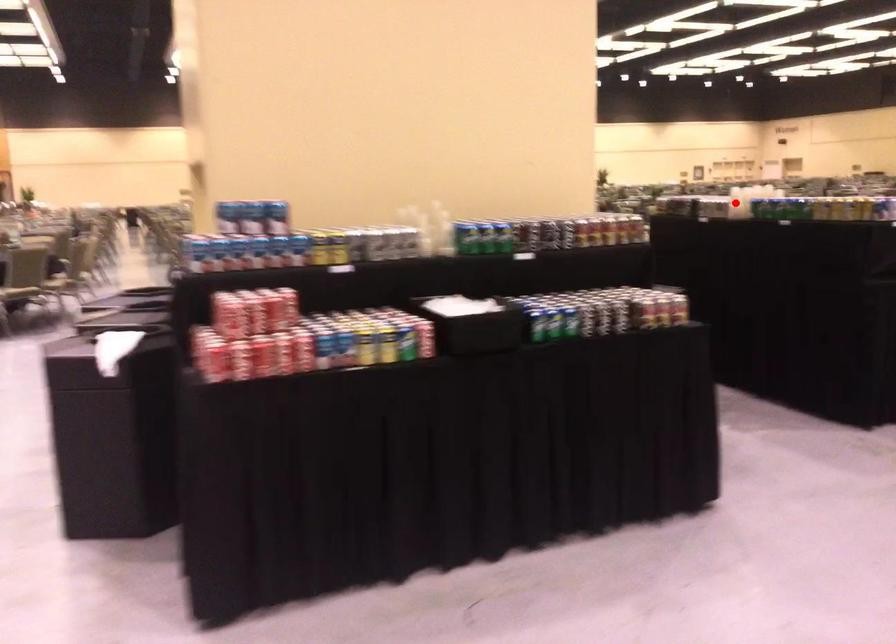
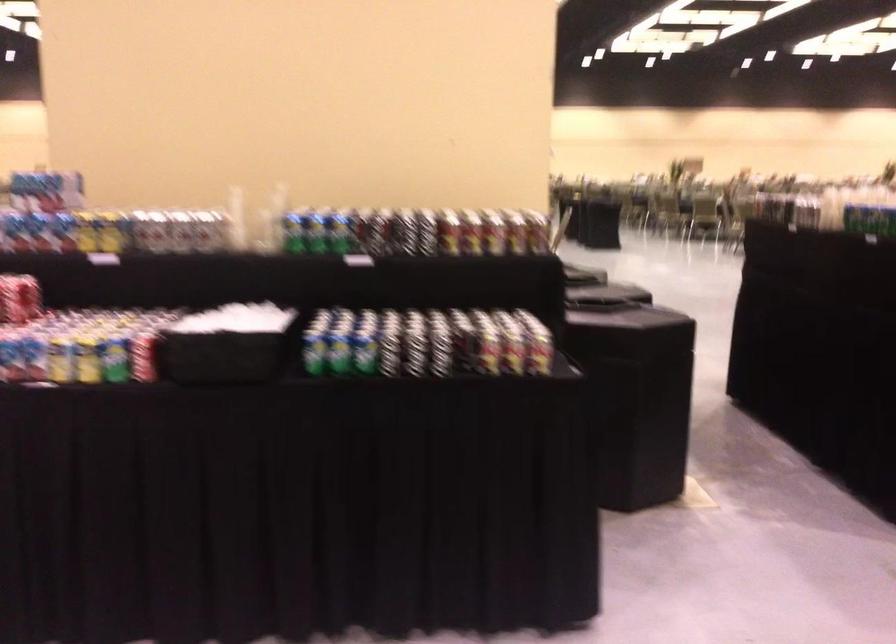
Question: I am providing you with two images of the same scene from different viewpoints. A red point is marked on the first image. Can you still see the location of the red point in image 2?

Choices:
 (A) Yes
 (B) No

Answer: (B)